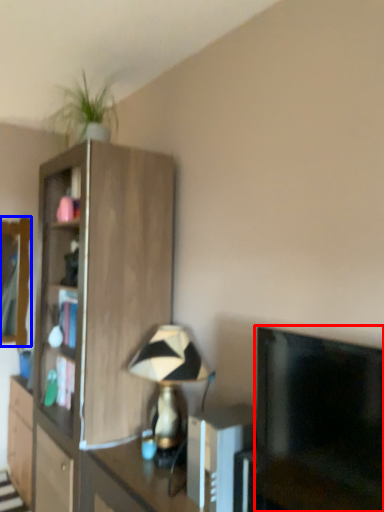
Question: Which object is further to the camera taking this photo, television (highlighted by a red box) or mirror (highlighted by a blue box)?

Choices:
 (A) television
 (B) mirror

Answer: (B)